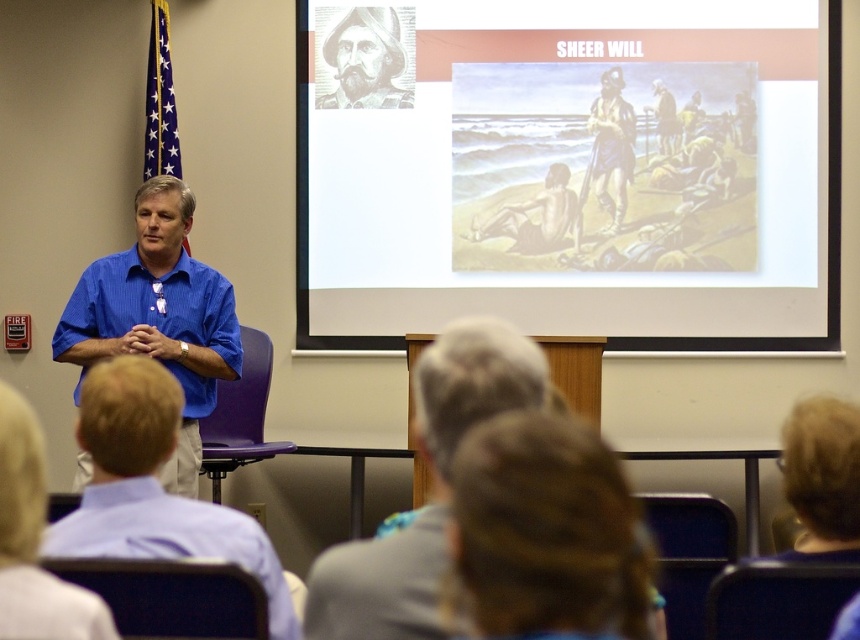
You are a photographer taking a picture of the speaker in the presentation. You notice the light brown hair at lower left and the brown textured jacket at upper center. Which object should you focus on if you want to capture the larger one in your photo?

The light brown hair at lower left is bigger than the brown textured jacket at upper center, so you should focus on the light brown hair at lower left to capture the larger one in your photo.

You are an attendee at the presentation and want to know which object is larger between the blue striped shirt at left and the gray textured portrait at upper center. Can you determine this based on your view?

The blue striped shirt at left is bigger than the gray textured portrait at upper center, so the blue striped shirt at left is larger.